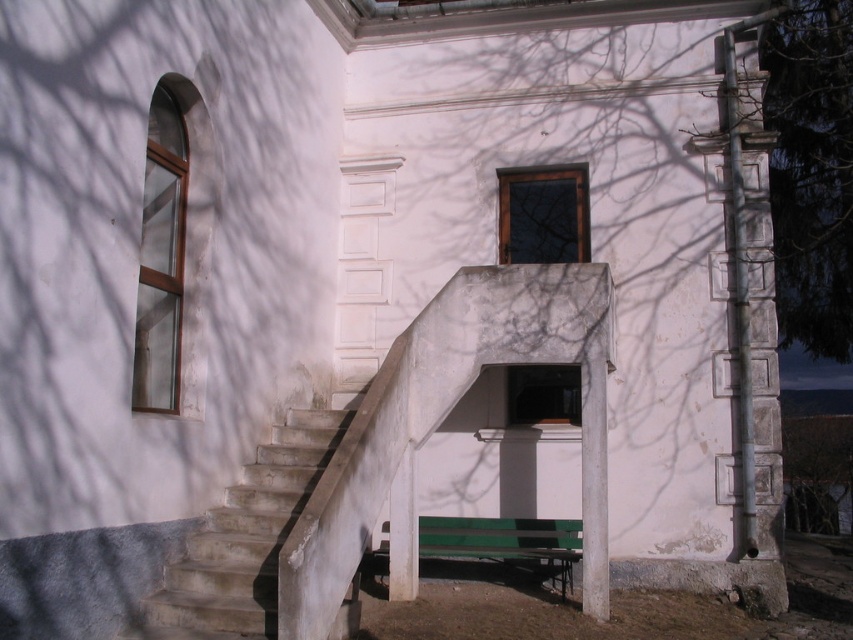
Question: Which object is the closest to the concrete stairs at center?

Choices:
 (A) green painted wood bench at lower center
 (B) wooden window at upper center
 (C) green textured stone column at right

Answer: (A)

Question: Is the position of green textured stone column at right less distant than that of green painted wood bench at lower center?

Choices:
 (A) yes
 (B) no

Answer: (B)

Question: Is wooden window at upper center below green painted wood bench at lower center?

Choices:
 (A) no
 (B) yes

Answer: (A)

Question: Can you confirm if green textured stone column at right is positioned to the right of green painted wood bench at lower center?

Choices:
 (A) no
 (B) yes

Answer: (B)

Question: Which of the following is the closest to the observer?

Choices:
 (A) (218, 538)
 (B) (161, 131)

Answer: (A)

Question: Which of the following is the closest to the observer?

Choices:
 (A) (146, 184)
 (B) (221, 570)
 (C) (555, 164)
 (D) (763, 112)

Answer: (B)